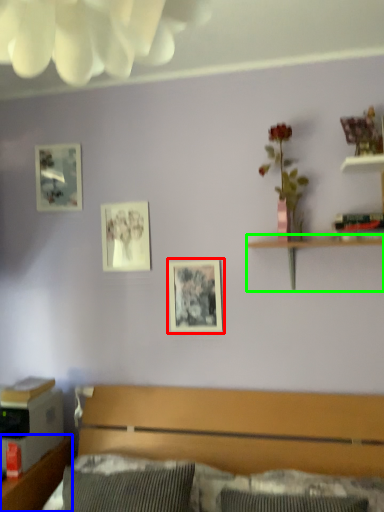
Question: Considering the real-world distances, which object is farthest from picture frame (highlighted by a red box)? dresser (highlighted by a blue box) or shelf (highlighted by a green box)?

Choices:
 (A) dresser
 (B) shelf

Answer: (A)